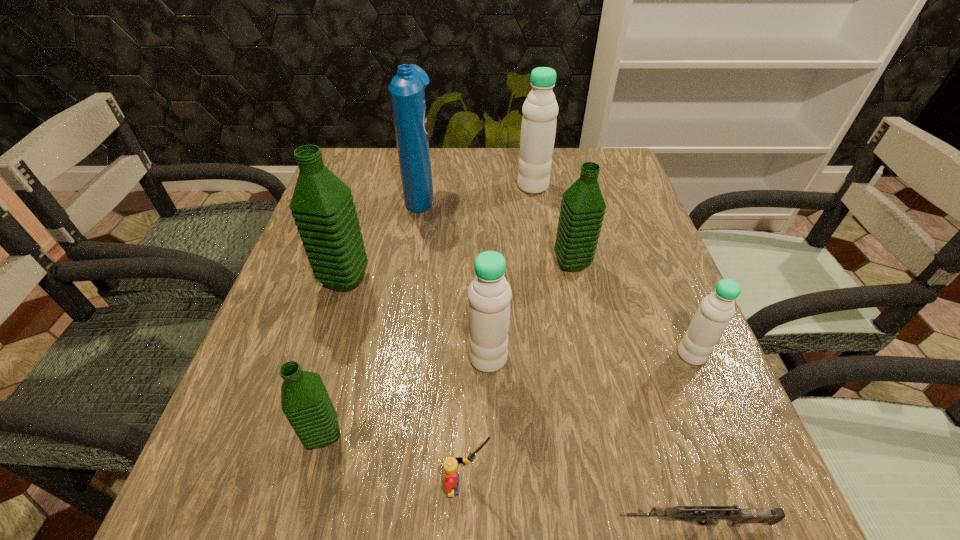
This screenshot has height=540, width=960. What are the coordinates of `water bottle that is the sixth closest to the nearest object` in the screenshot? It's located at (540, 109).

What are the coordinates of `water bottle identified as the fifth closest to the smallest white water bottle` in the screenshot? It's located at (322, 205).

Select which white water bottle is the second closest to the biggest green water bottle. Please provide its 2D coordinates. Your answer should be formatted as a tuple, i.e. [(x, y)], where the tuple contains the x and y coordinates of a point satisfying the conditions above.

[(540, 109)]

Select which white water bottle is the closest to the gun. Please provide its 2D coordinates. Your answer should be formatted as a tuple, i.e. [(x, y)], where the tuple contains the x and y coordinates of a point satisfying the conditions above.

[(716, 310)]

Select which green water bottle appears as the second closest to the biggest white water bottle. Please provide its 2D coordinates. Your answer should be formatted as a tuple, i.e. [(x, y)], where the tuple contains the x and y coordinates of a point satisfying the conditions above.

[(322, 205)]

At what (x,y) coordinates should I click in order to perform the action: click on green water bottle that is the second closest to the second smallest green water bottle. Please return your answer as a coordinate pair (x, y). Looking at the image, I should click on (305, 402).

This screenshot has width=960, height=540. Identify the location of vacant point that satisfies the following two spatial constraints: 1. on the front side of the farthest water bottle; 2. on the front-facing side of the yellow Lego. (578, 485).

Where is `vacant space that satisfies the following two spatial constraints: 1. on the front side of the rightmost water bottle; 2. on the left side of the third object from left to right`? The width and height of the screenshot is (960, 540). vacant space that satisfies the following two spatial constraints: 1. on the front side of the rightmost water bottle; 2. on the left side of the third object from left to right is located at coordinates (395, 355).